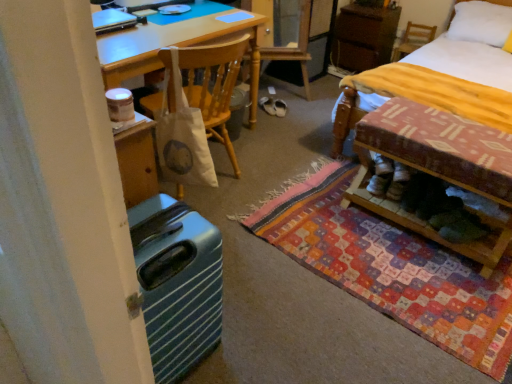
Find the location of a particular element. The image size is (512, 384). free space in front of white fabric shoe at center, the first footwear viewed from the right is located at coordinates (285, 120).